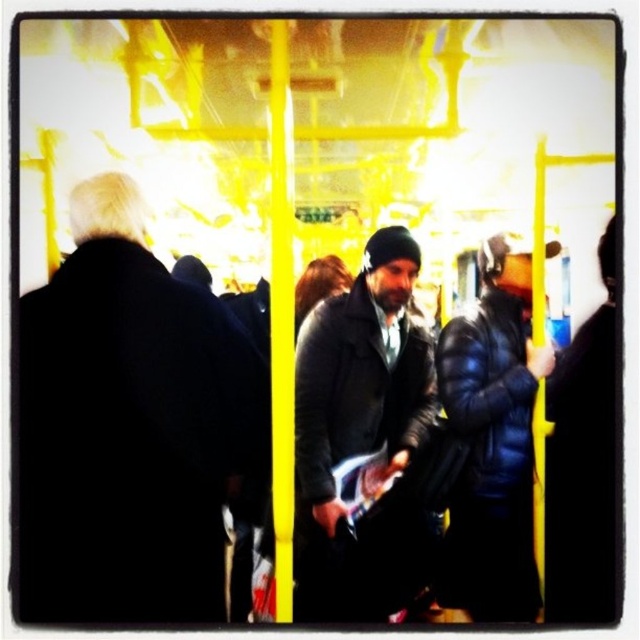
Question: Is dark gray leather jacket at center positioned before dark blue puffy jacket at center?

Choices:
 (A) no
 (B) yes

Answer: (A)

Question: Can you confirm if black matte coat at left is positioned to the right of dark blue puffy jacket at center?

Choices:
 (A) yes
 (B) no

Answer: (B)

Question: Which point is farther from the camera taking this photo?

Choices:
 (A) (307, 400)
 (B) (122, 269)

Answer: (A)

Question: Which of the following is the closest to the observer?

Choices:
 (A) dark blue puffy jacket at center
 (B) black matte coat at left

Answer: (B)

Question: Which object is closer to the camera taking this photo?

Choices:
 (A) black matte coat at left
 (B) dark gray leather jacket at center
 (C) matte black jacket at center
 (D) dark blue puffy jacket at center

Answer: (A)

Question: Can you confirm if dark gray leather jacket at center is bigger than matte black jacket at center?

Choices:
 (A) yes
 (B) no

Answer: (B)